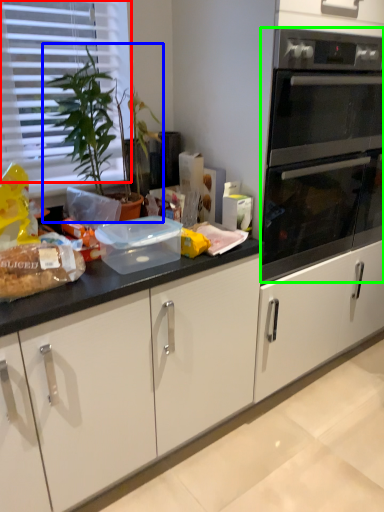
Question: Which is farther away from blind (highlighted by a red box)? houseplant (highlighted by a blue box) or oven (highlighted by a green box)?

Choices:
 (A) houseplant
 (B) oven

Answer: (B)